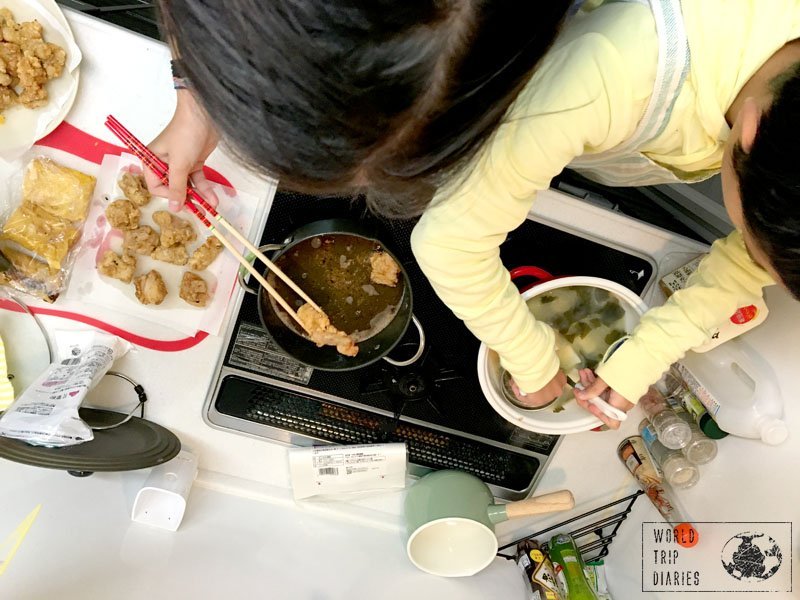
The height and width of the screenshot is (600, 800). I want to click on pot handles, so click(x=533, y=274), click(x=596, y=432), click(x=402, y=368), click(x=270, y=245).